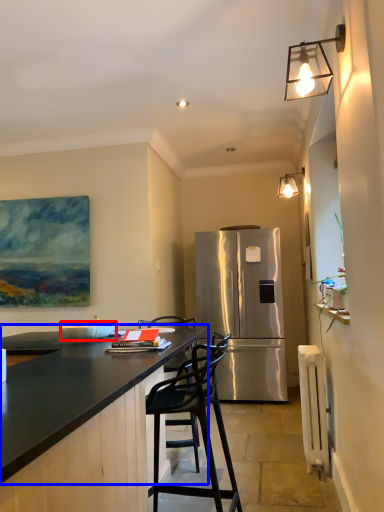
Question: Which point is closer to the camera, bowl (highlighted by a red box) or countertop (highlighted by a blue box)?

Choices:
 (A) bowl
 (B) countertop

Answer: (B)